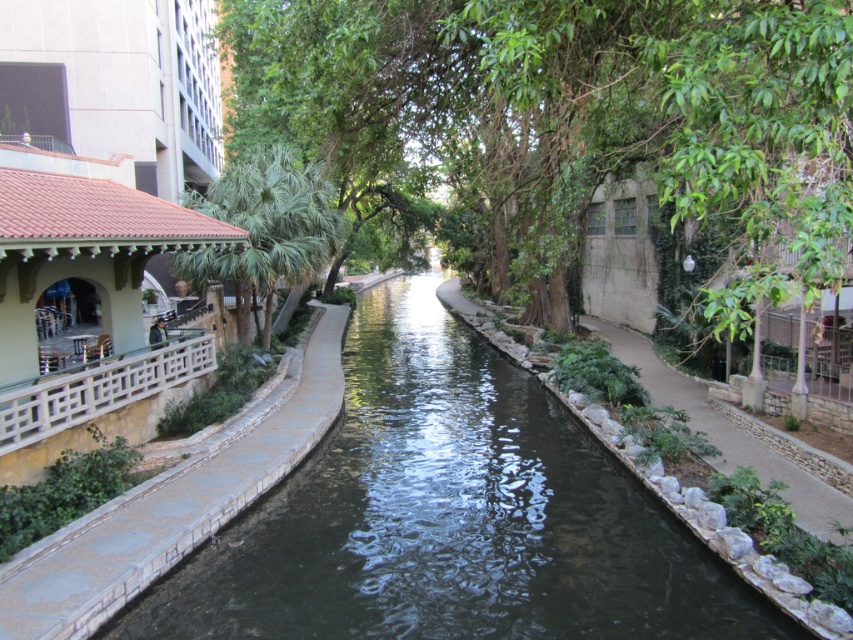
You are standing on the paved walkway next to the dark concrete stream at center and want to reach the green stone wall at right. Which direction should you move to get there?

The dark concrete stream at center is below the green stone wall at right, so you should move upward or to the right to reach the green stone wall at right.

You are standing on the paved walkway and want to take a photo of both the dark concrete stream at center and the green leafy tree at left. Which object should you focus on first to ensure both are in clear view?

You should focus on the dark concrete stream at center first because it is closer to you than the green leafy tree at left, ensuring both are in clear focus when using depth of field.

You are a tourist walking along the canal and want to take a photo of both the dark concrete stream at center and the green stone wall at right. Which object should you position yourself to the left of to ensure both are in the frame?

You should position yourself to the left of the green stone wall at right because the dark concrete stream at center is on its left side, so both will be visible in the frame when you stand there.